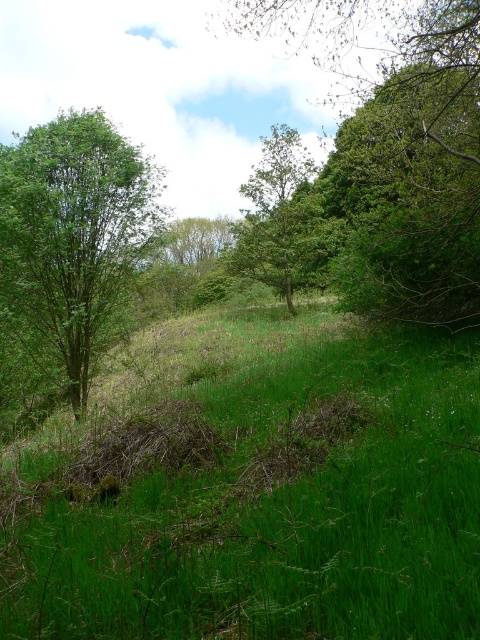
Can you confirm if green leafy tree at upper center is positioned to the right of green leafy tree at left?

Yes, green leafy tree at upper center is to the right of green leafy tree at left.

Consider the image. Can you confirm if green leafy tree at upper center is positioned to the left of green leafy tree at left?

No, green leafy tree at upper center is not to the left of green leafy tree at left.

Describe the element at coordinates (396, 144) in the screenshot. I see `green leafy tree at upper center` at that location.

Locate an element on the screen. Image resolution: width=480 pixels, height=640 pixels. green leafy tree at upper center is located at coordinates (396, 144).

Is green grassy at center below green leafy tree at center?

Yes.

Where is `green grassy at center`? This screenshot has height=640, width=480. green grassy at center is located at coordinates (260, 488).

Can you confirm if green leafy tree at upper center is positioned to the right of green leafy tree at center?

Correct, you'll find green leafy tree at upper center to the right of green leafy tree at center.

Can you confirm if green leafy tree at upper center is positioned above green leafy tree at center?

Yes.

Which is in front, point (323, 4) or point (291, 253)?

Point (291, 253) is more forward.

Find the location of `green leafy tree at upper center`. green leafy tree at upper center is located at coordinates coord(396,144).